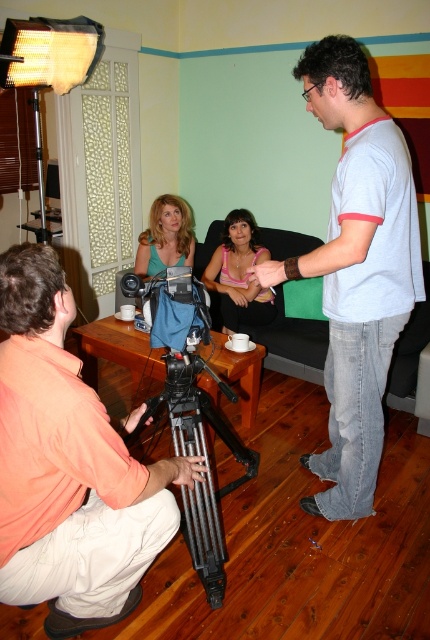
Can you confirm if orange cotton shirt at lower left is wider than white cotton t-shirt at center?

No, orange cotton shirt at lower left is not wider than white cotton t-shirt at center.

Which is in front, point (11, 426) or point (411, 304)?

Point (11, 426)

Between point (135, 554) and point (328, 93), which one is positioned behind?

Positioned behind is point (328, 93).

What are the coordinates of `orange cotton shirt at lower left` in the screenshot? It's located at point(65,467).

This screenshot has width=430, height=640. What do you see at coordinates (205, 461) in the screenshot?
I see `black matte tripod at lower center` at bounding box center [205, 461].

Who is positioned more to the right, black matte tripod at lower center or blonde hair at center?

Positioned to the right is black matte tripod at lower center.

Does point (233, 445) come in front of point (159, 259)?

Yes, point (233, 445) is closer to viewer.

What are the coordinates of `black matte tripod at lower center` in the screenshot? It's located at (205, 461).

Can you confirm if matte black hand at center is wider than matte black hand at lower left?

Indeed, matte black hand at center has a greater width compared to matte black hand at lower left.

Is point (264, 280) behind point (126, 420)?

Yes, point (264, 280) is farther from viewer.

This screenshot has height=640, width=430. Find the location of `matte black hand at center`. matte black hand at center is located at coordinates (267, 273).